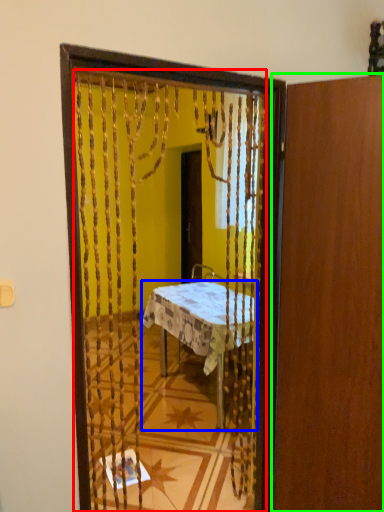
Question: Estimate the real-world distances between objects in this image. Which object is closer to mirror (highlighted by a red box), desk (highlighted by a blue box) or door (highlighted by a green box)?

Choices:
 (A) desk
 (B) door

Answer: (A)